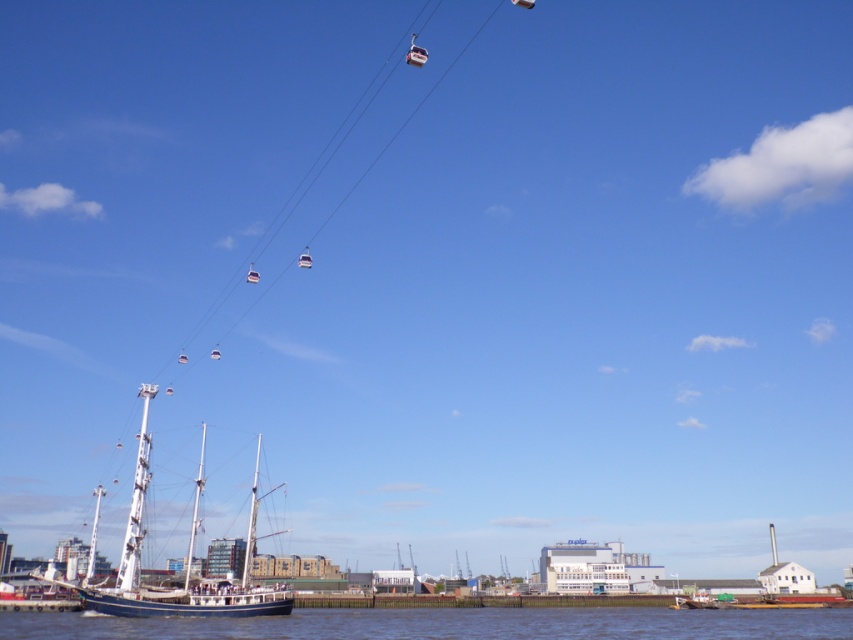
Question: Is blue water at lower center wider than wooden sailboat at lower left?

Choices:
 (A) yes
 (B) no

Answer: (A)

Question: Which point is farther to the camera?

Choices:
 (A) wooden sailboat at lower left
 (B) blue water at lower center

Answer: (A)

Question: Which point is closer to the camera?

Choices:
 (A) blue water at lower center
 (B) wooden sailboat at lower left

Answer: (A)

Question: Is blue water at lower center above wooden sailboat at lower left?

Choices:
 (A) no
 (B) yes

Answer: (B)

Question: Does blue water at lower center have a greater width compared to wooden sailboat at lower left?

Choices:
 (A) no
 (B) yes

Answer: (B)